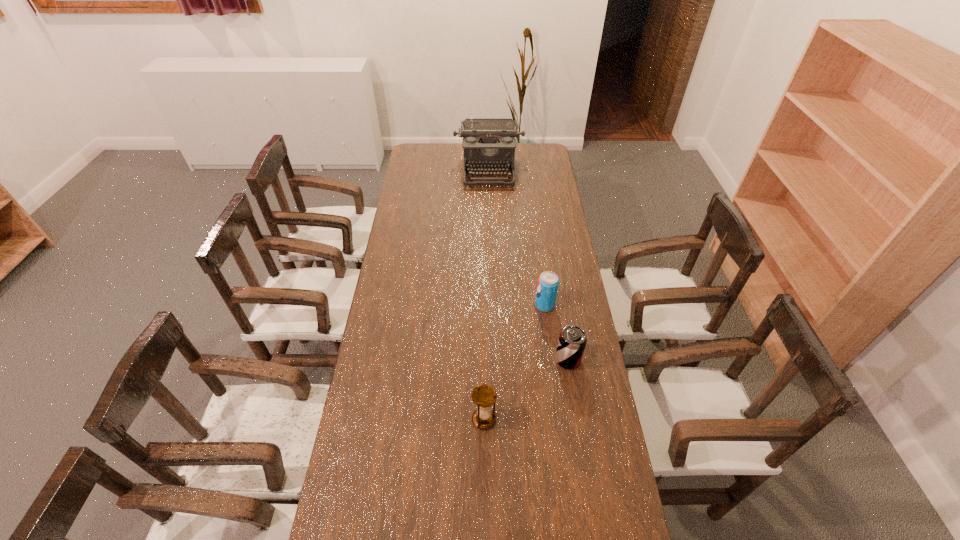
You are a GUI agent. You are given a task and a screenshot of the screen. Output one action in this format:
    pyautogui.click(x=<x>, y=<y>)
    Task: Click on the farthest object
    
    Given the screenshot: What is the action you would take?
    pyautogui.click(x=489, y=143)

This screenshot has width=960, height=540. I want to click on typewriter, so click(x=489, y=143).

The height and width of the screenshot is (540, 960). What are the coordinates of `the farther soda can` in the screenshot? It's located at (548, 282).

The width and height of the screenshot is (960, 540). In order to click on hourglass in this screenshot , I will do `click(484, 396)`.

Find the location of a particular element. the third farthest object is located at coordinates (572, 340).

Find the location of `vacant space located 0.280m on the typing side of the typewriter`. vacant space located 0.280m on the typing side of the typewriter is located at coordinates (491, 225).

The height and width of the screenshot is (540, 960). What are the coordinates of `free space located 0.180m on the front of the third nearest object` in the screenshot? It's located at (551, 353).

At what (x,y) coordinates should I click in order to perform the action: click on free space located 0.120m on the left of the nearest object. Please return your answer as a coordinate pair (x, y). The width and height of the screenshot is (960, 540). Looking at the image, I should click on (433, 419).

Image resolution: width=960 pixels, height=540 pixels. In order to click on free location located on the back of the nearer soda can in this screenshot , I will do `click(558, 295)`.

Where is `object that is positioned at the far edge`? object that is positioned at the far edge is located at coordinates (489, 143).